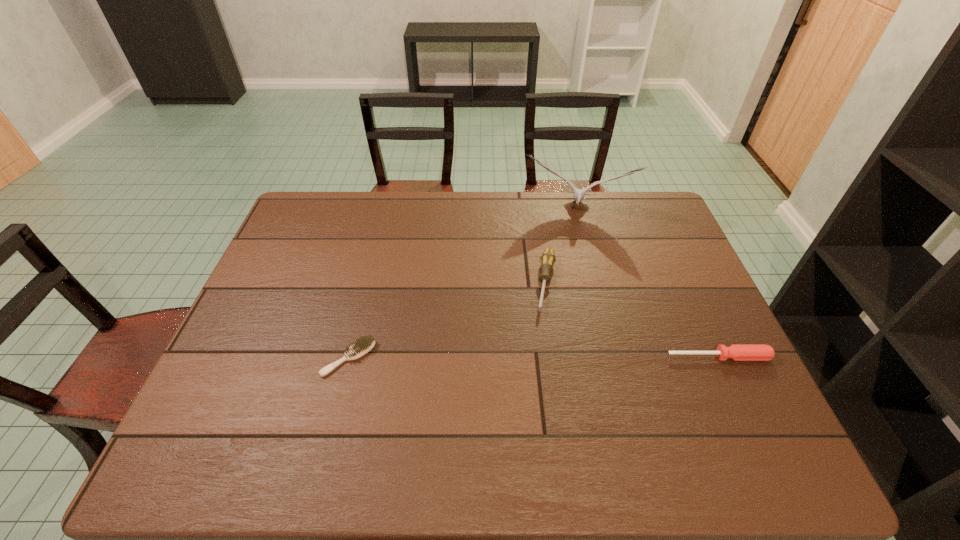
At what (x,y) coordinates should I click in order to perform the action: click on vacant region located at the tip of the beak of the gull. Please return your answer as a coordinate pair (x, y). This screenshot has height=540, width=960. Looking at the image, I should click on [x=565, y=235].

At what (x,y) coordinates should I click in order to perform the action: click on vacant space situated 0.360m at the tip of the beak of the gull. Please return your answer as a coordinate pair (x, y). Looking at the image, I should click on (558, 300).

This screenshot has width=960, height=540. In order to click on blank space located 0.070m at the tip of the beak of the gull in this screenshot , I will do `click(565, 237)`.

This screenshot has width=960, height=540. I want to click on vacant area located 0.130m at the tip of the second tallest object, so click(x=542, y=355).

This screenshot has width=960, height=540. What are the coordinates of `free space located at the tip of the second tallest object` in the screenshot? It's located at (537, 395).

Locate an element on the screen. The image size is (960, 540). free region located at the tip of the second tallest object is located at coordinates (535, 407).

This screenshot has height=540, width=960. What are the coordinates of `object that is at the far edge` in the screenshot? It's located at (579, 194).

Locate an element on the screen. Image resolution: width=960 pixels, height=540 pixels. screwdriver present at the right edge is located at coordinates 737,352.

Locate an element on the screen. This screenshot has width=960, height=540. gull at the right edge is located at coordinates (579, 194).

Where is `object situated at the far right corner`? The height and width of the screenshot is (540, 960). object situated at the far right corner is located at coordinates (579, 194).